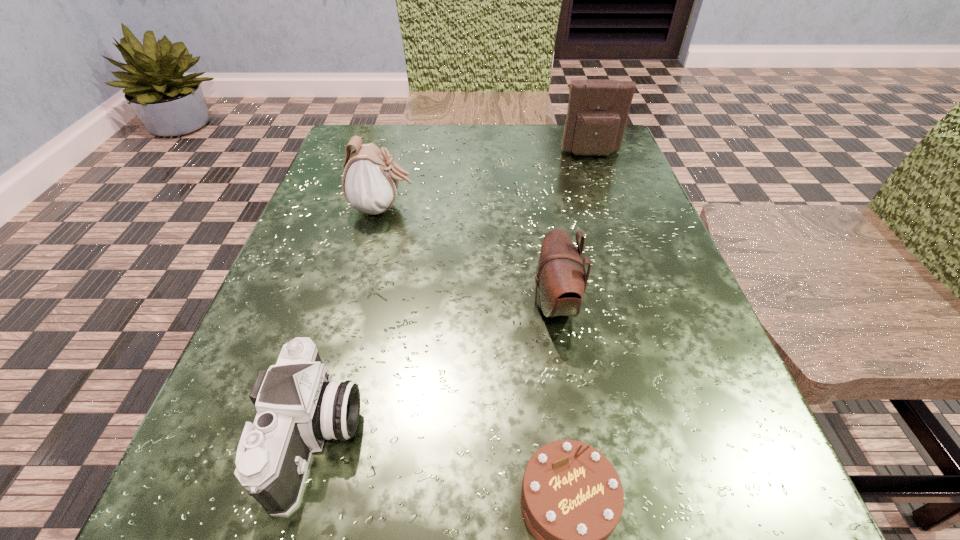
Where is `free space at the far edge of the desktop`? free space at the far edge of the desktop is located at coordinates (520, 133).

In order to click on vacant space at the near edge of the desktop in this screenshot , I will do `click(423, 524)`.

The height and width of the screenshot is (540, 960). Identify the location of vacant area at the left edge of the desktop. (214, 460).

What are the coordinates of `blank area at the right edge` in the screenshot? It's located at (607, 183).

In the image, there is a desktop. Where is `free space at the far left corner`? The width and height of the screenshot is (960, 540). free space at the far left corner is located at coordinates (404, 126).

In the image, there is a desktop. At what (x,y) coordinates should I click in order to perform the action: click on vacant area at the far right corner. Please return your answer as a coordinate pair (x, y). The image size is (960, 540). Looking at the image, I should click on (579, 173).

In the image, there is a desktop. Where is `vacant space at the near right corner`? Image resolution: width=960 pixels, height=540 pixels. vacant space at the near right corner is located at coordinates (643, 479).

Locate an element on the screen. This screenshot has width=960, height=540. free space that is in between the shortest pouch and the camera is located at coordinates (436, 371).

Find the location of a particular element. The height and width of the screenshot is (540, 960). blank region between the nearest pouch and the leftmost pouch is located at coordinates (469, 256).

Locate an element on the screen. This screenshot has height=540, width=960. unoccupied position between the shortest pouch and the camera is located at coordinates (436, 371).